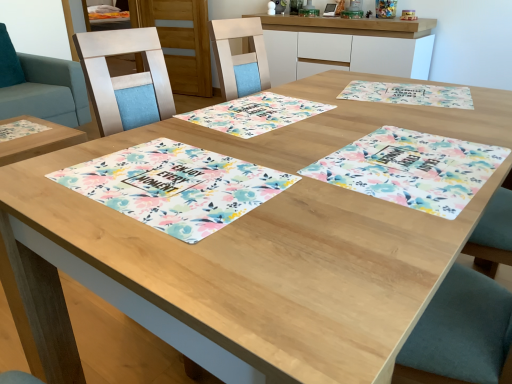
Locate an element on the screen. vacant area that lies in front of floral fabric placemat at upper right, marked as the first place mat in a right-to-left arrangement is located at coordinates (428, 121).